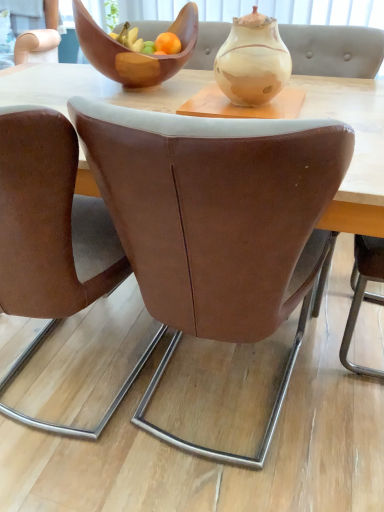
The width and height of the screenshot is (384, 512). Identify the location of wooden bowl at upper center. (134, 52).

Identify the location of brown leather chair at center, the 1th chair in the right-to-left sequence. (217, 224).

The height and width of the screenshot is (512, 384). What do you see at coordinates (252, 61) in the screenshot?
I see `marbled ceramic vase at center` at bounding box center [252, 61].

Where is `marbled ceramic vase at center`? Image resolution: width=384 pixels, height=512 pixels. marbled ceramic vase at center is located at coordinates (252, 61).

In order to click on wooden bowl at upper center in this screenshot , I will do `click(134, 52)`.

Based on the photo, from the image's perspective, which object appears higher, marbled ceramic vase at center or wooden bowl at upper center?

From the image's view, wooden bowl at upper center is above.

From a real-world perspective, which is physically below, marbled ceramic vase at center or wooden bowl at upper center?

wooden bowl at upper center is physically lower.

Image resolution: width=384 pixels, height=512 pixels. In the image, there is a wooden bowl at upper center. What are the coordinates of `vase below it (from the image's perspective)` in the screenshot? It's located at (252, 61).

Is point (179, 272) positioned in front of point (67, 214)?

No.

Considering the relative positions of brown leather chair at center, the 1th chair in the right-to-left sequence, and brown leather chair at left, acting as the 2th chair starting from the right, in the image provided, is brown leather chair at center, the 1th chair in the right-to-left sequence, to the right of brown leather chair at left, acting as the 2th chair starting from the right, from the viewer's perspective?

Yes.

Consider the image. Is brown leather chair at center, marked as the second chair in a left-to-right arrangement, facing towards brown leather chair at left, acting as the 2th chair starting from the right?

Yes, brown leather chair at center, marked as the second chair in a left-to-right arrangement, is aimed at brown leather chair at left, acting as the 2th chair starting from the right.

From a real-world perspective, is brown leather chair at center, marked as the second chair in a left-to-right arrangement, below brown leather chair at left, the first chair viewed from the left?

Indeed, from a real-world perspective, brown leather chair at center, marked as the second chair in a left-to-right arrangement, is positioned beneath brown leather chair at left, the first chair viewed from the left.

Is marbled ceramic vase at center to the left of brown leather chair at left, acting as the 2th chair starting from the right, from the viewer's perspective?

No.

Is marbled ceramic vase at center oriented away from brown leather chair at left, acting as the 2th chair starting from the right?

That's not correct — marbled ceramic vase at center is not looking away from brown leather chair at left, acting as the 2th chair starting from the right.

From a real-world perspective, does marbled ceramic vase at center sit lower than brown leather chair at left, the first chair viewed from the left?

Actually, marbled ceramic vase at center is physically above brown leather chair at left, the first chair viewed from the left, in the real world.

Between point (241, 84) and point (26, 256), which one is positioned in front?

The point (26, 256) is closer to the camera.

Consider the image. Between brown leather chair at left, acting as the 2th chair starting from the right, and wooden bowl at upper center, which one has smaller size?

With smaller size is wooden bowl at upper center.

Is brown leather chair at left, acting as the 2th chair starting from the right, looking in the opposite direction of wooden bowl at upper center?

No, brown leather chair at left, acting as the 2th chair starting from the right, is not facing away from wooden bowl at upper center.

Which is more to the right, brown leather chair at left, the first chair viewed from the left, or wooden bowl at upper center?

wooden bowl at upper center.

Is wooden bowl at upper center oriented towards brown leather chair at left, the first chair viewed from the left?

Yes, wooden bowl at upper center faces towards brown leather chair at left, the first chair viewed from the left.

Considering the relative sizes of wooden bowl at upper center and brown leather chair at left, the first chair viewed from the left, in the image provided, is wooden bowl at upper center shorter than brown leather chair at left, the first chair viewed from the left,?

Yes, wooden bowl at upper center is shorter than brown leather chair at left, the first chair viewed from the left.

Would you say wooden bowl at upper center is to the left or to the right of brown leather chair at left, the first chair viewed from the left, in the picture?

Clearly, wooden bowl at upper center is on the right of brown leather chair at left, the first chair viewed from the left, in the image.

From the image's perspective, which is below, wooden bowl at upper center or brown leather chair at left, acting as the 2th chair starting from the right?

brown leather chair at left, acting as the 2th chair starting from the right, appears lower in the image.

Considering the relative sizes of brown leather chair at center, the 1th chair in the right-to-left sequence, and wooden bowl at upper center in the image provided, is brown leather chair at center, the 1th chair in the right-to-left sequence, bigger than wooden bowl at upper center?

Correct, brown leather chair at center, the 1th chair in the right-to-left sequence, is larger in size than wooden bowl at upper center.

Is brown leather chair at center, the 1th chair in the right-to-left sequence, oriented towards wooden bowl at upper center?

No, brown leather chair at center, the 1th chair in the right-to-left sequence, does not turn towards wooden bowl at upper center.

In terms of height, does brown leather chair at center, marked as the second chair in a left-to-right arrangement, look taller or shorter compared to wooden bowl at upper center?

brown leather chair at center, marked as the second chair in a left-to-right arrangement, is taller than wooden bowl at upper center.

Relative to wooden bowl at upper center, is brown leather chair at center, marked as the second chair in a left-to-right arrangement, in front or behind?

Clearly, brown leather chair at center, marked as the second chair in a left-to-right arrangement, is in front of wooden bowl at upper center.

Looking at their sizes, would you say brown leather chair at left, acting as the 2th chair starting from the right, is wider or thinner than marbled ceramic vase at center?

In the image, brown leather chair at left, acting as the 2th chair starting from the right, appears to be wider than marbled ceramic vase at center.

Is there a large distance between brown leather chair at left, the first chair viewed from the left, and marbled ceramic vase at center?

They are positioned close to each other.

Would you say brown leather chair at left, acting as the 2th chair starting from the right, is to the left or to the right of marbled ceramic vase at center in the picture?

brown leather chair at left, acting as the 2th chair starting from the right, is positioned on marbled ceramic vase at center's left side.

This screenshot has height=512, width=384. In order to click on vase located below the wooden bowl at upper center (from the image's perspective) in this screenshot , I will do `click(252, 61)`.

The image size is (384, 512). In order to click on chair on the right of brown leather chair at left, acting as the 2th chair starting from the right in this screenshot , I will do 217,224.

Which object lies nearer to the anchor point wooden bowl at upper center, brown leather chair at left, the first chair viewed from the left, or brown leather chair at center, marked as the second chair in a left-to-right arrangement?

Among the two, brown leather chair at left, the first chair viewed from the left, is located nearer to wooden bowl at upper center.

Estimate the real-world distances between objects in this image. Which object is closer to brown leather chair at left, the first chair viewed from the left, wooden bowl at upper center or brown leather chair at center, marked as the second chair in a left-to-right arrangement?

Based on the image, brown leather chair at center, marked as the second chair in a left-to-right arrangement, appears to be nearer to brown leather chair at left, the first chair viewed from the left.

Which object lies nearer to the anchor point brown leather chair at left, the first chair viewed from the left, wooden bowl at upper center or marbled ceramic vase at center?

marbled ceramic vase at center lies closer to brown leather chair at left, the first chair viewed from the left, than the other object.

In the scene shown: Looking at the image, which one is located closer to marbled ceramic vase at center, brown leather chair at left, acting as the 2th chair starting from the right, or brown leather chair at center, marked as the second chair in a left-to-right arrangement?

brown leather chair at center, marked as the second chair in a left-to-right arrangement, lies closer to marbled ceramic vase at center than the other object.

Based on their spatial positions, is brown leather chair at center, marked as the second chair in a left-to-right arrangement, or marbled ceramic vase at center closer to brown leather chair at left, the first chair viewed from the left?

brown leather chair at center, marked as the second chair in a left-to-right arrangement, is positioned closer to the anchor brown leather chair at left, the first chair viewed from the left.

When comparing their distances from brown leather chair at center, marked as the second chair in a left-to-right arrangement, does brown leather chair at left, acting as the 2th chair starting from the right, or wooden bowl at upper center seem further?

Based on the image, wooden bowl at upper center appears to be further to brown leather chair at center, marked as the second chair in a left-to-right arrangement.

Considering their positions, is wooden bowl at upper center positioned closer to marbled ceramic vase at center than brown leather chair at center, marked as the second chair in a left-to-right arrangement?

Among the two, wooden bowl at upper center is located nearer to marbled ceramic vase at center.

Based on their spatial positions, is brown leather chair at center, the 1th chair in the right-to-left sequence, or brown leather chair at left, the first chair viewed from the left, closer to wooden bowl at upper center?

Based on the image, brown leather chair at left, the first chair viewed from the left, appears to be nearer to wooden bowl at upper center.

Identify the location of vase between wooden bowl at upper center and brown leather chair at left, the first chair viewed from the left, in the up-down direction. (252, 61).

Image resolution: width=384 pixels, height=512 pixels. Find the location of `chair situated between brown leather chair at left, acting as the 2th chair starting from the right, and marbled ceramic vase at center from left to right`. chair situated between brown leather chair at left, acting as the 2th chair starting from the right, and marbled ceramic vase at center from left to right is located at coordinates (x=217, y=224).

Find the location of a particular element. vase between wooden bowl at upper center and brown leather chair at center, the 1th chair in the right-to-left sequence, in the up-down direction is located at coordinates (252, 61).

Image resolution: width=384 pixels, height=512 pixels. Identify the location of chair between wooden bowl at upper center and brown leather chair at left, the first chair viewed from the left, from top to bottom. (217, 224).